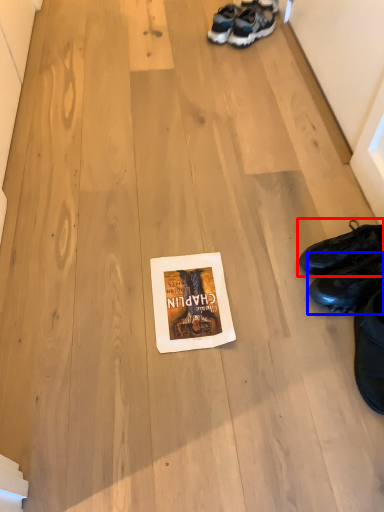
Question: Which object appears farthest to the camera in this image, footwear (highlighted by a red box) or footwear (highlighted by a blue box)?

Choices:
 (A) footwear
 (B) footwear

Answer: (A)